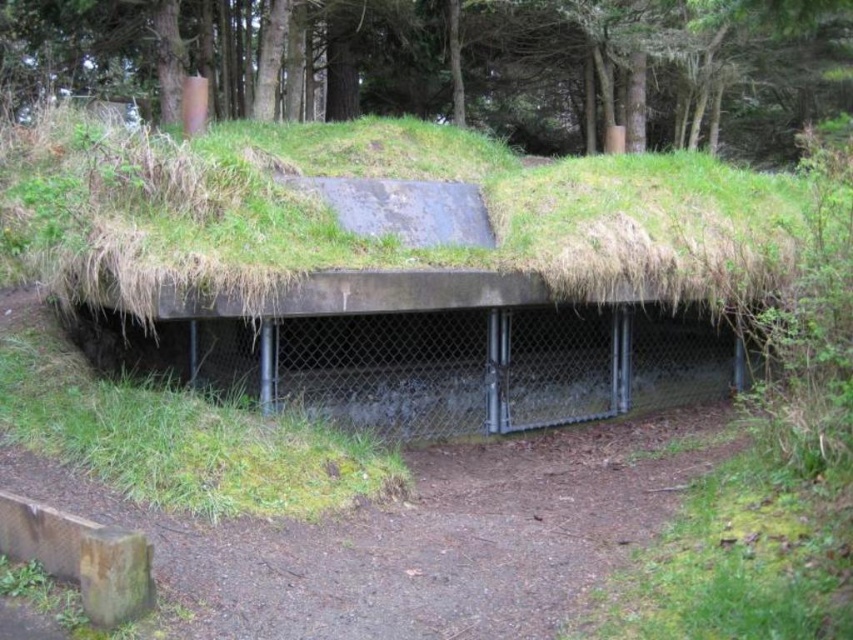
Question: Which object appears farthest from the camera in this image?

Choices:
 (A) green moss-covered shelter at center
 (B) green grassy mound at upper center

Answer: (B)

Question: Does green moss-covered shelter at center have a smaller size compared to green grassy mound at upper center?

Choices:
 (A) no
 (B) yes

Answer: (B)

Question: Which object appears closest to the camera in this image?

Choices:
 (A) green grassy mound at upper center
 (B) green moss-covered shelter at center

Answer: (B)

Question: Is green moss-covered shelter at center to the left of green grassy mound at upper center from the viewer's perspective?

Choices:
 (A) no
 (B) yes

Answer: (B)

Question: Which object appears closest to the camera in this image?

Choices:
 (A) green grassy mound at upper center
 (B) green moss-covered shelter at center

Answer: (B)

Question: Does green moss-covered shelter at center have a smaller size compared to green grassy mound at upper center?

Choices:
 (A) yes
 (B) no

Answer: (A)